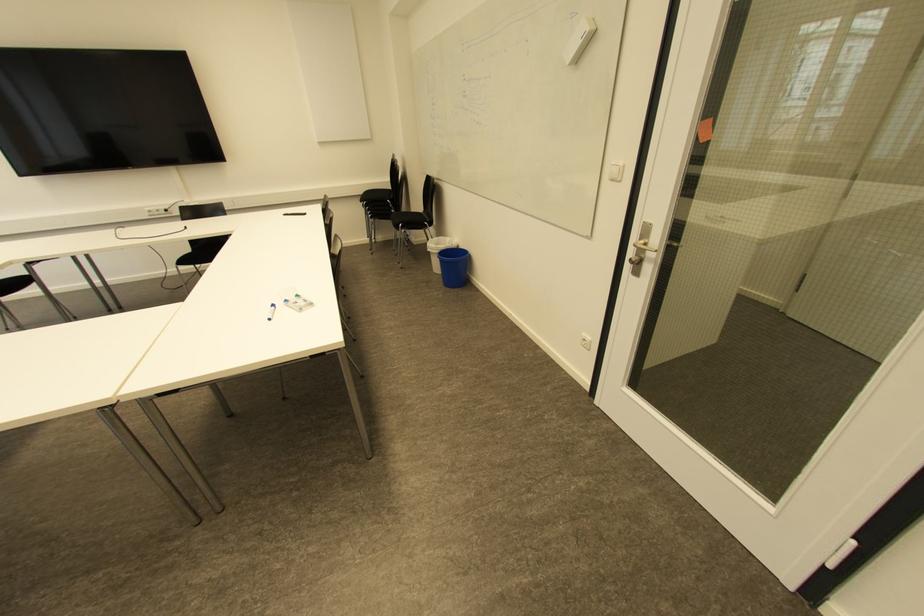
Where would you lift the blue whiteboard marker? Please return your answer as a coordinate pair (x, y).

(271, 312)